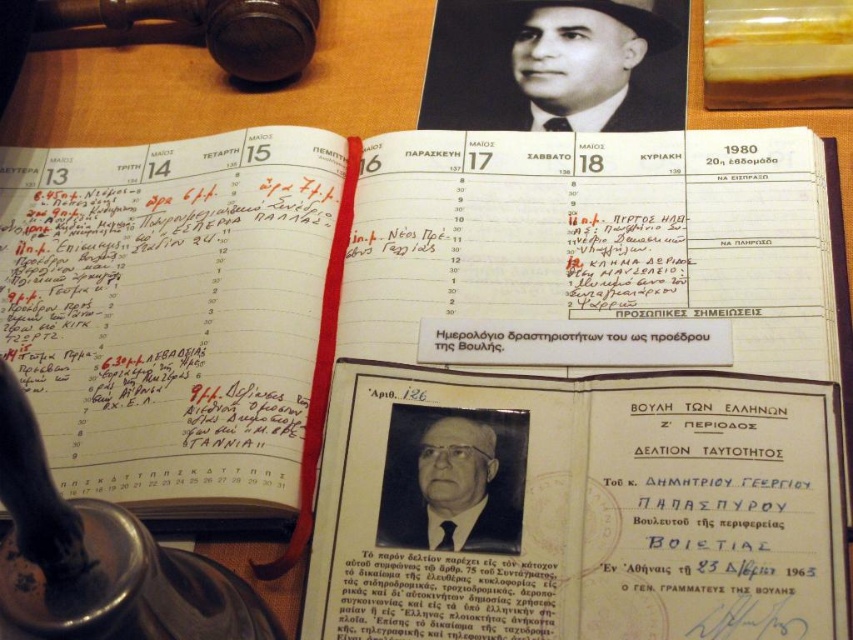
Is white paper document at center positioned in front of smooth black hat at upper center?

Yes.

Who is more forward, [786,406] or [666,81]?

Positioned in front is point [786,406].

This screenshot has height=640, width=853. What are the coordinates of `white paper document at center` in the screenshot? It's located at (576, 508).

The height and width of the screenshot is (640, 853). In order to click on white paper document at center in this screenshot , I will do `click(576, 508)`.

Is smooth black hat at upper center bigger than black glossy photo of man at center?

Correct, smooth black hat at upper center is larger in size than black glossy photo of man at center.

Does smooth black hat at upper center have a greater height compared to black glossy photo of man at center?

Indeed, smooth black hat at upper center has a greater height compared to black glossy photo of man at center.

Who is more forward, (664, 74) or (471, 545)?

Point (471, 545) is in front.

This screenshot has width=853, height=640. In order to click on smooth black hat at upper center in this screenshot , I will do `click(592, 67)`.

Who is taller, white paper document at center or black glossy photo of man at center?

white paper document at center is taller.

Is point (364, 513) farther from viewer compared to point (438, 538)?

Yes, it is.

Describe the element at coordinates (576, 508) in the screenshot. I see `white paper document at center` at that location.

Find the location of a particular element. This screenshot has width=853, height=640. white paper document at center is located at coordinates (576, 508).